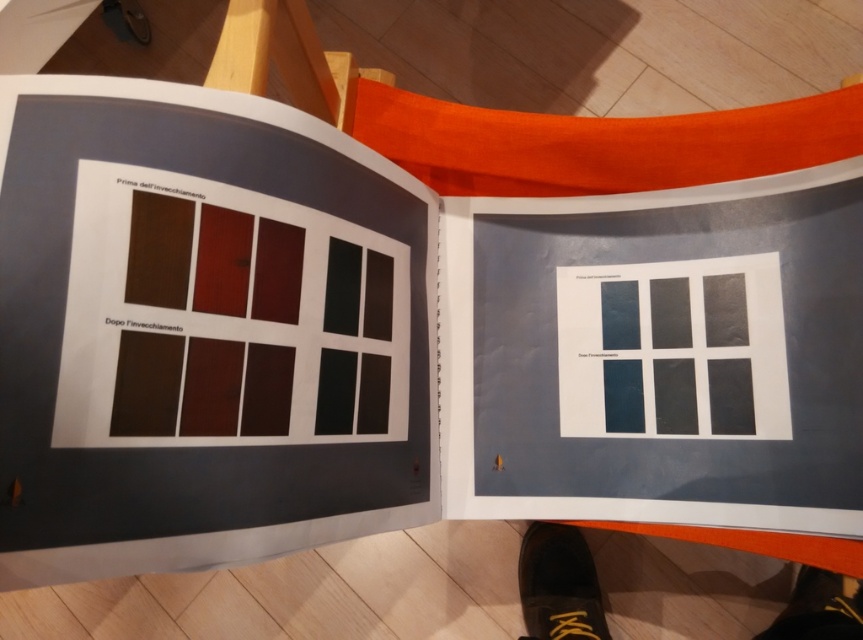
Does point (827, 602) lie in front of point (589, 609)?

Yes, point (827, 602) is in front of point (589, 609).

Can you confirm if black leather shoe at lower right is thinner than black leather shoe at lower center?

Correct, black leather shoe at lower right's width is less than black leather shoe at lower center's.

This screenshot has height=640, width=863. I want to click on black leather shoe at lower right, so click(559, 584).